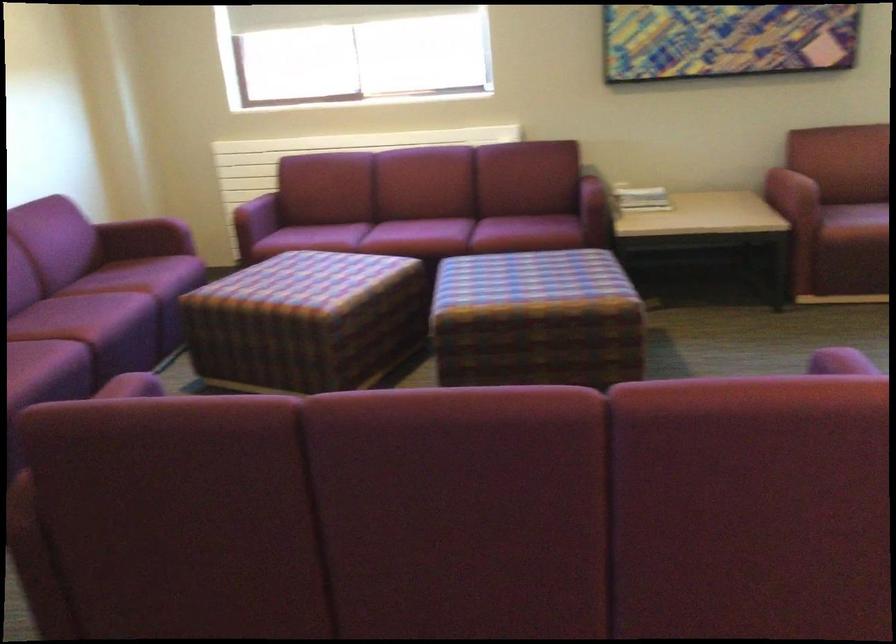
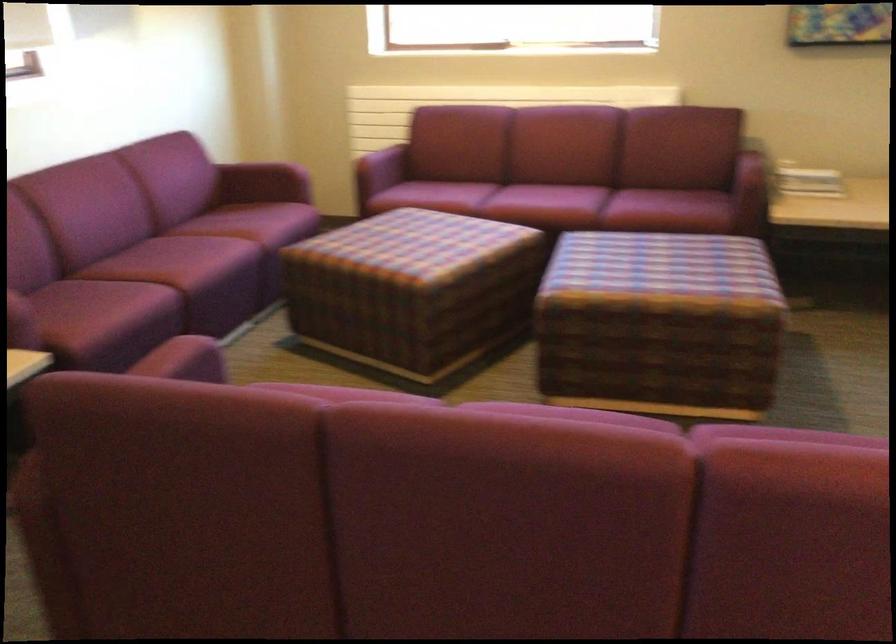
In the second image, find the point that corresponds to point (314, 238) in the first image.

(432, 196)